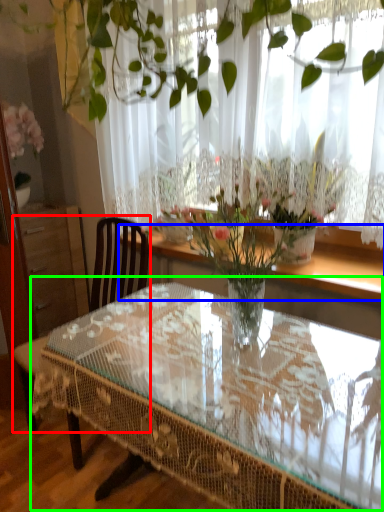
Question: Which object is positioned farthest from chair (highlighted by a red box)? Select from window sill (highlighted by a blue box) and coffee table (highlighted by a green box).

Choices:
 (A) window sill
 (B) coffee table

Answer: (A)